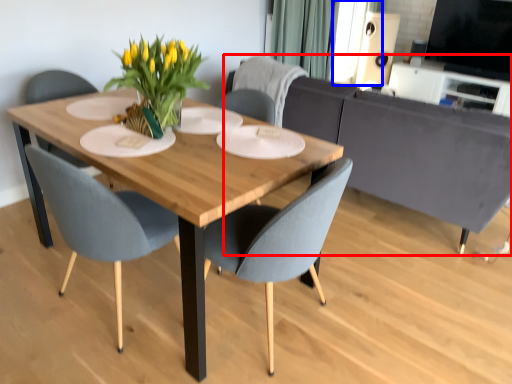
Question: Which of the following is the closest to the observer, couch (highlighted by a red box) or window screen (highlighted by a blue box)?

Choices:
 (A) couch
 (B) window screen

Answer: (A)